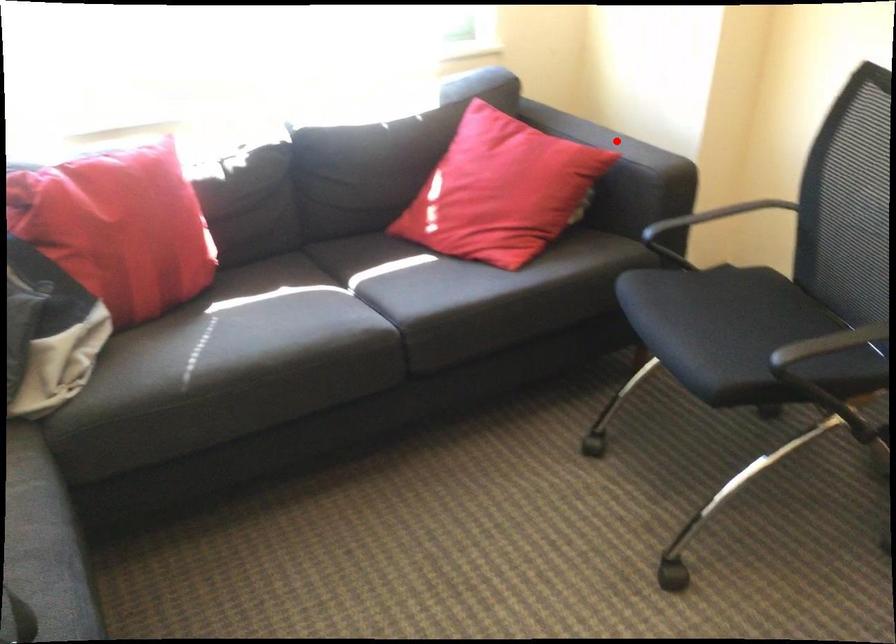
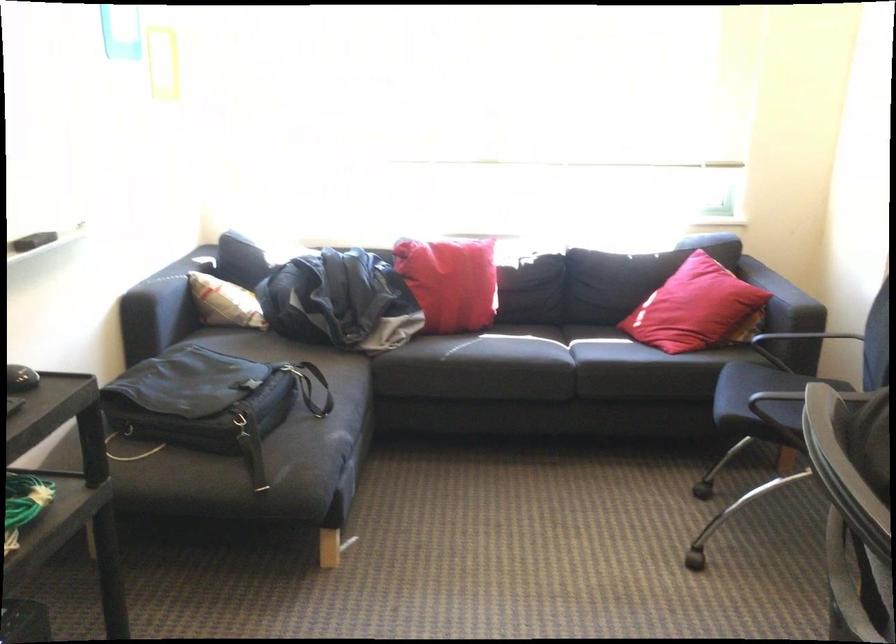
Question: I am providing you with two images of the same scene from different viewpoints. A red point is marked on the first image. Can you still see the location of the red point in image 2?

Choices:
 (A) Yes
 (B) No

Answer: (B)